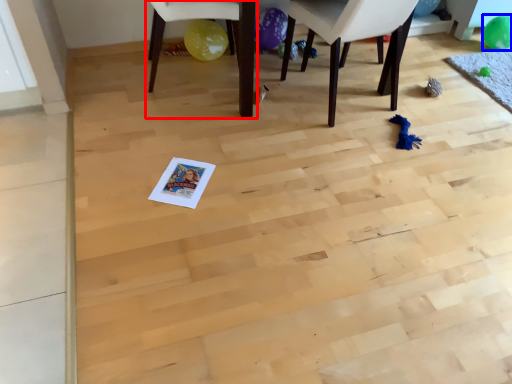
Question: Which object appears farthest to the camera in this image, chair (highlighted by a red box) or balloon (highlighted by a blue box)?

Choices:
 (A) chair
 (B) balloon

Answer: (B)